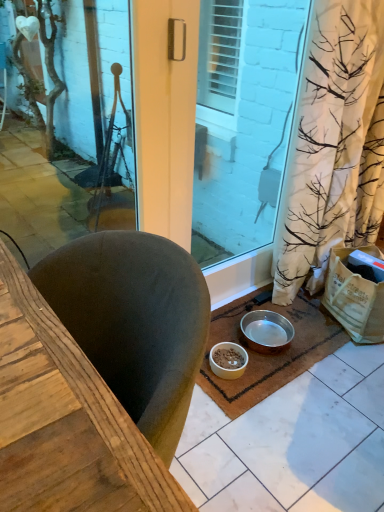
The width and height of the screenshot is (384, 512). I want to click on blank space situated above brown coir mat at lower center (from a real-world perspective), so click(x=253, y=343).